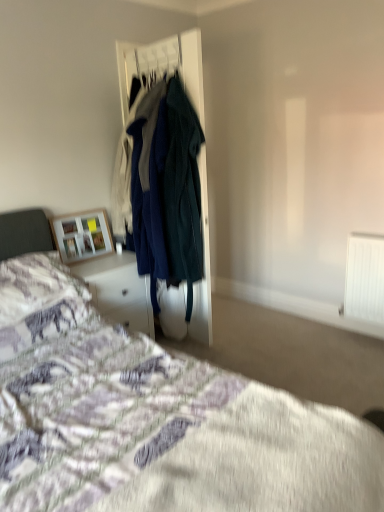
Question: Is wooden frame at upper left next to purple cotton bedspread at lower left and touching it?

Choices:
 (A) yes
 (B) no

Answer: (B)

Question: From a real-world perspective, is wooden frame at upper left positioned over purple cotton bedspread at lower left based on gravity?

Choices:
 (A) no
 (B) yes

Answer: (B)

Question: Is wooden frame at upper left bigger than purple cotton bedspread at lower left?

Choices:
 (A) yes
 (B) no

Answer: (B)

Question: Considering the relative sizes of wooden frame at upper left and purple cotton bedspread at lower left in the image provided, is wooden frame at upper left taller than purple cotton bedspread at lower left?

Choices:
 (A) no
 (B) yes

Answer: (A)

Question: Is wooden frame at upper left completely or partially outside of purple cotton bedspread at lower left?

Choices:
 (A) yes
 (B) no

Answer: (A)

Question: From the image's perspective, does wooden frame at upper left appear higher than purple cotton bedspread at lower left?

Choices:
 (A) yes
 (B) no

Answer: (A)

Question: Would you say fluffy white pillow at lower left is outside white glossy vanity at lower left?

Choices:
 (A) no
 (B) yes

Answer: (B)

Question: Are fluffy white pillow at lower left and white glossy vanity at lower left located far from each other?

Choices:
 (A) yes
 (B) no

Answer: (B)

Question: Is fluffy white pillow at lower left turned away from white glossy vanity at lower left?

Choices:
 (A) yes
 (B) no

Answer: (B)

Question: Does fluffy white pillow at lower left contain white glossy vanity at lower left?

Choices:
 (A) yes
 (B) no

Answer: (B)

Question: Is fluffy white pillow at lower left in front of white glossy vanity at lower left?

Choices:
 (A) yes
 (B) no

Answer: (A)

Question: Is fluffy white pillow at lower left oriented towards white glossy vanity at lower left?

Choices:
 (A) yes
 (B) no

Answer: (B)

Question: Is white glossy vanity at lower left bigger than fluffy white pillow at lower left?

Choices:
 (A) yes
 (B) no

Answer: (A)